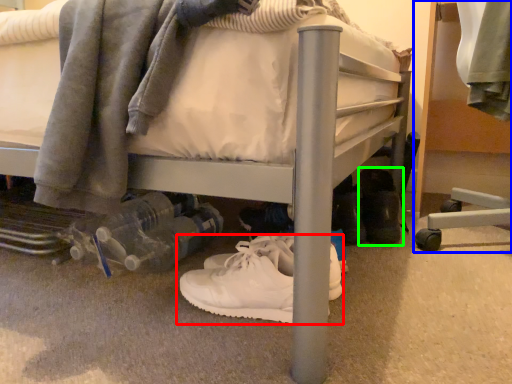
Question: Considering the real-world distances, which object is closest to footwear (highlighted by a red box)? furniture (highlighted by a blue box) or footwear (highlighted by a green box).

Choices:
 (A) furniture
 (B) footwear

Answer: (B)